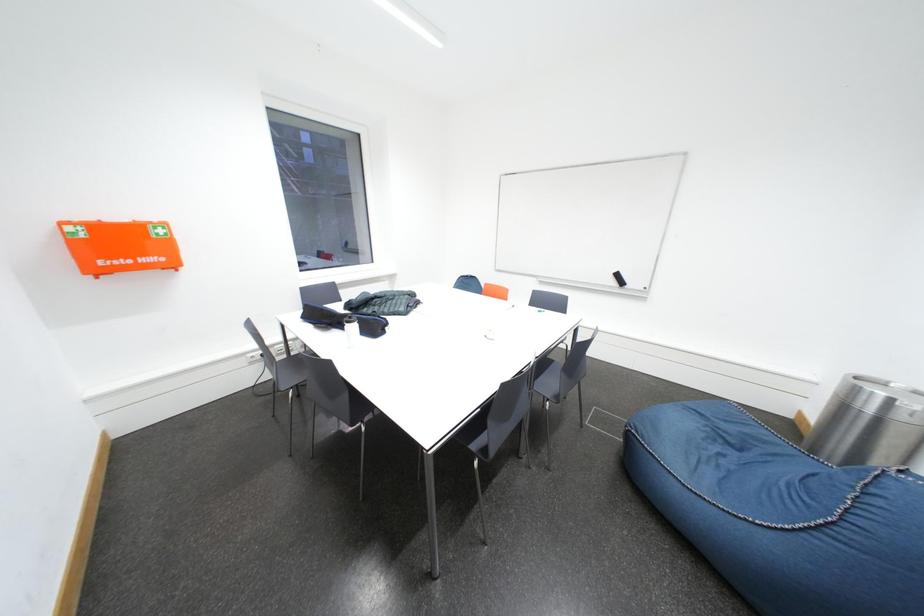
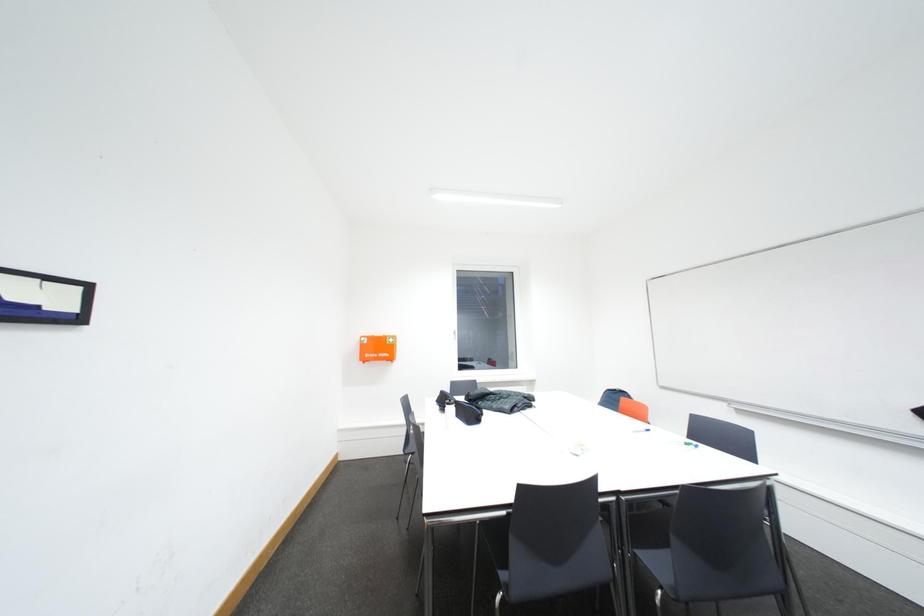
First-person continuous shooting, in which direction is the camera rotating?

The camera's rotation is toward left-up.